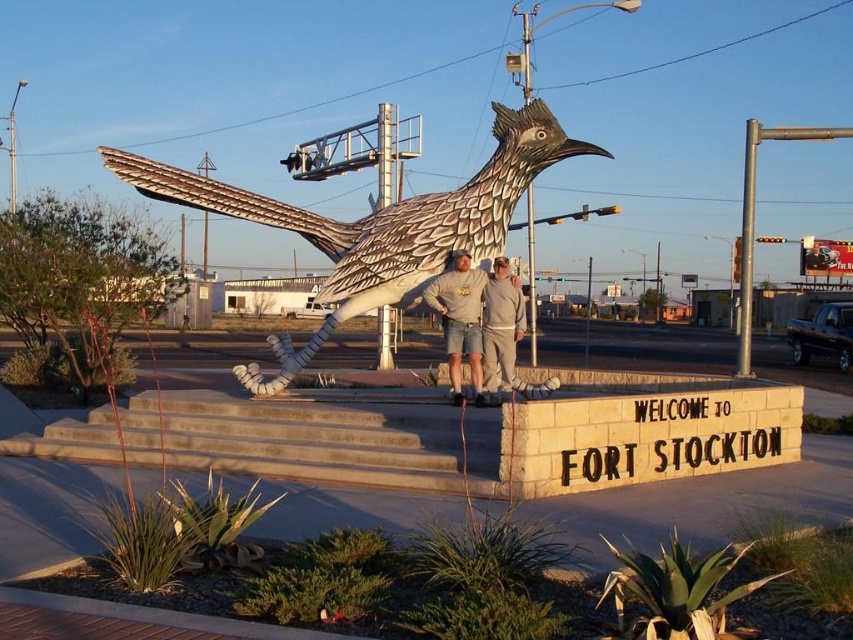
Is gray cotton sweatshirt at center to the right of gray fleece sweatshirt at center from the viewer's perspective?

No, gray cotton sweatshirt at center is not to the right of gray fleece sweatshirt at center.

Is point (456, 392) positioned in front of point (486, 307)?

No, it is not.

Where is `gray cotton sweatshirt at center`? gray cotton sweatshirt at center is located at coordinates tap(460, 320).

Who is positioned more to the left, white painted wood roadrunner at center or gray cotton sweatshirt at center?

white painted wood roadrunner at center is more to the left.

What do you see at coordinates (376, 225) in the screenshot? This screenshot has height=640, width=853. I see `white painted wood roadrunner at center` at bounding box center [376, 225].

Between point (433, 211) and point (438, 310), which one is positioned behind?

Point (433, 211)

Find the location of a particular element. The width and height of the screenshot is (853, 640). white painted wood roadrunner at center is located at coordinates (376, 225).

Is white painted wood roadrunner at center positioned before gray fleece sweatshirt at center?

That is False.

Can you confirm if white painted wood roadrunner at center is positioned above gray fleece sweatshirt at center?

Indeed, white painted wood roadrunner at center is positioned over gray fleece sweatshirt at center.

Between point (412, 282) and point (488, 372), which one is positioned in front?

Point (412, 282) is more forward.

Locate an element on the screen. This screenshot has width=853, height=640. white painted wood roadrunner at center is located at coordinates (376, 225).